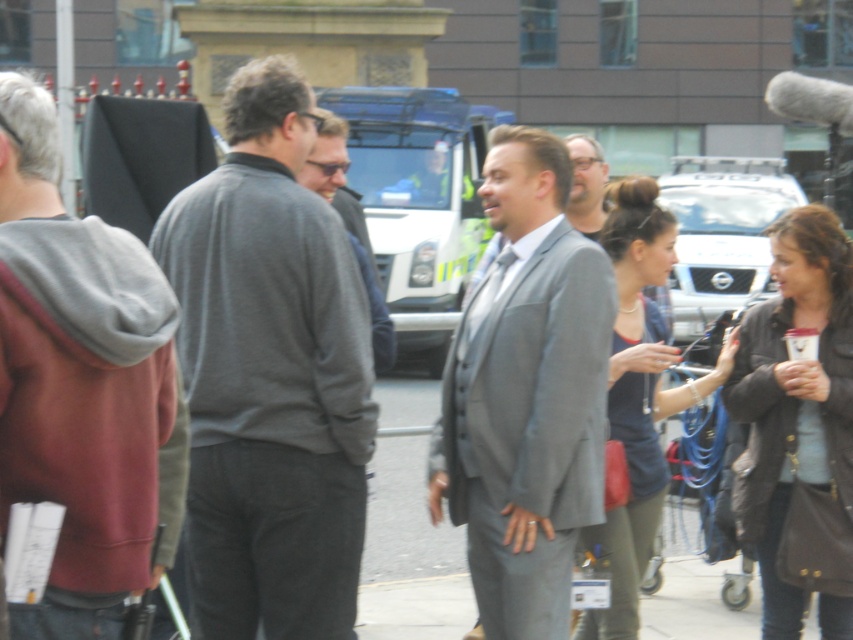
You are a photographer trying to capture a group photo of the dark gray sweater at center and the brown leather jacket at center. The camera you are using has a maximum focus range of 1 meter. Can you fit both subjects within the camera frame without moving either of them?

The dark gray sweater at center is 1.30 meters away from the brown leather jacket at center. Since the camera can only focus up to 1 meter, the distance between them exceeds the focus range, so you cannot capture both subjects in focus simultaneously without moving them.

You are organizing a photo shoot and need to arrange the gray hoodie at left and matte blue top at center based on their sizes. Which clothing item should you place on the smaller clothing rack?

The gray hoodie at left should be placed on the smaller clothing rack since its width is less than the matte blue top at center.

You are attending an outdoor event and notice two people in the crowd. One is wearing a gray hoodie at left and another in a matte blue top at center. From your perspective, which person is positioned more to the left side of the scene?

The gray hoodie at left is positioned more to the left side of the scene compared to the matte blue top at center.